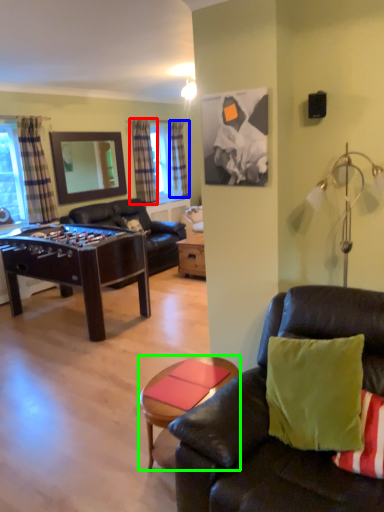
Question: Considering the real-world distances, which object is farthest from curtain (highlighted by a red box)? curtain (highlighted by a blue box) or coffee table (highlighted by a green box)?

Choices:
 (A) curtain
 (B) coffee table

Answer: (B)